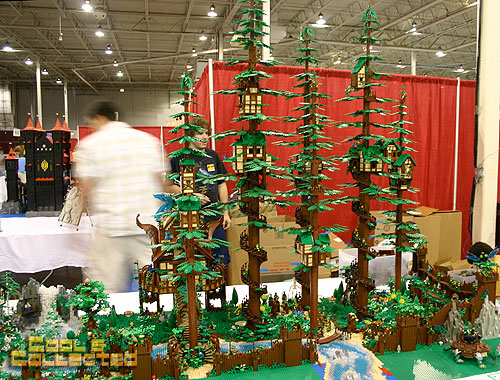
You are a GUI agent. You are given a task and a screenshot of the screen. Output one action in this format:
    pyautogui.click(x=<x>, y=<y>)
    Task: Click on the tables
    The width and height of the screenshot is (500, 380).
    Given the screenshot: What is the action you would take?
    pyautogui.click(x=35, y=231), pyautogui.click(x=125, y=299)